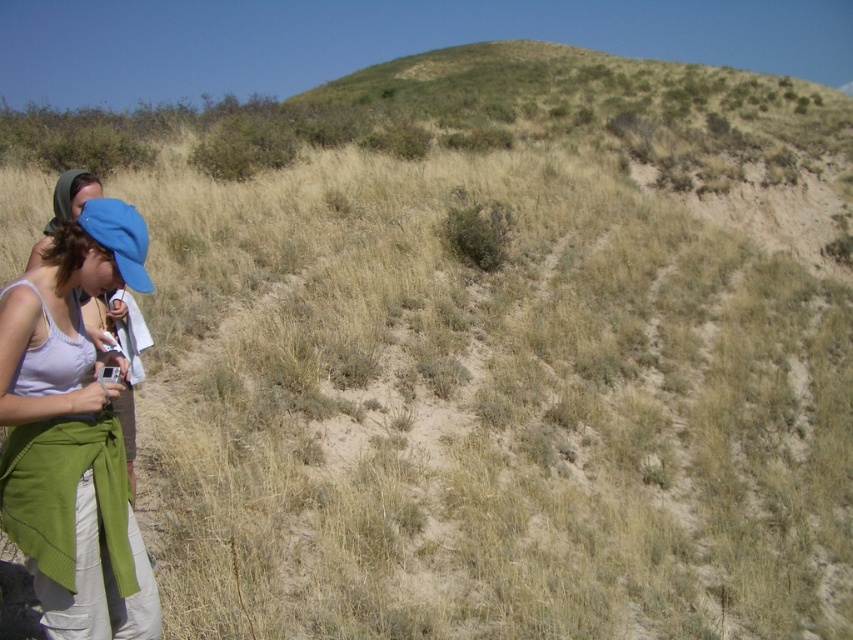
Does matte white tank top at lower left have a greater width compared to blue fabric cap at left?

Indeed, matte white tank top at lower left has a greater width compared to blue fabric cap at left.

Describe the element at coordinates (65, 205) in the screenshot. I see `matte white tank top at lower left` at that location.

The width and height of the screenshot is (853, 640). Find the location of `matte white tank top at lower left`. matte white tank top at lower left is located at coordinates (65, 205).

Does green knitted scarf at lower left have a lesser height compared to matte white tank top at lower left?

No.

Measure the distance between green knitted scarf at lower left and camera.

A distance of 8.37 feet exists between green knitted scarf at lower left and camera.

Between point (10, 316) and point (74, 195), which one is positioned in front?

Point (10, 316)

This screenshot has width=853, height=640. Identify the location of green knitted scarf at lower left. (73, 435).

Does green knitted scarf at lower left appear over blue fabric cap at left?

No, green knitted scarf at lower left is not above blue fabric cap at left.

Consider the image. Measure the distance between point (x=54, y=584) and camera.

They are 2.87 meters apart.

Which is in front, point (6, 378) or point (140, 291)?

Positioned in front is point (6, 378).

Identify the location of green knitted scarf at lower left. (73, 435).